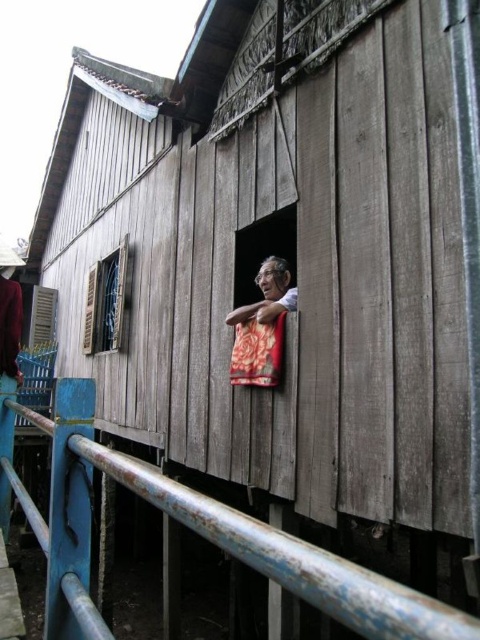
You are a delivery person trying to reach the front door of the rustic wooden house. You see the rusty metal railing at lower left and the floral fabric at window. Which object is closer to your current position?

The rusty metal railing at lower left is closer to your current position because it is only 4.67 feet away from the floral fabric at window, implying it is nearer to the delivery person standing at the starting point.

You are a delivery person trying to reach the door of the rustic wooden house. You see the floral fabric at window and the wooden shutter at left. The path between them is narrow. Can you pass through the space between them?

The floral fabric at window and wooden shutter at left are 3.07 meters apart, so yes, you can pass through the space between them as 3.07 meters is wider than the average human width.

You are standing in front of the rustic wooden house and want to determine which object is nearer to you. Which one is closer between the floral fabric at window and the wooden shutter at left?

The floral fabric at window is closer to the viewer than the wooden shutter at left.